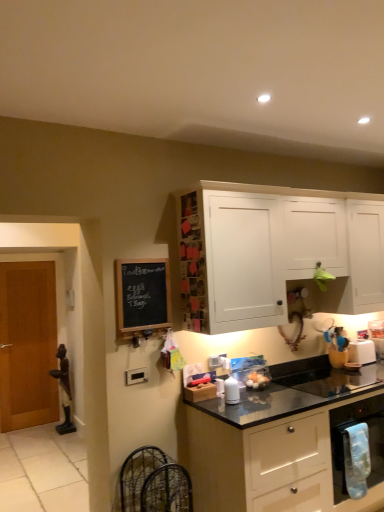
Question: Is white glossy salt shaker at center, which is the 2th appliance from right to left, facing towards white plastic toaster at right, which is the 2th appliance in front-to-back order?

Choices:
 (A) yes
 (B) no

Answer: (B)

Question: Is white glossy salt shaker at center, which is the 2th appliance from right to left, outside white plastic toaster at right, acting as the 1th appliance starting from the right?

Choices:
 (A) yes
 (B) no

Answer: (A)

Question: Can you confirm if white glossy salt shaker at center, which appears as the 1th appliance when viewed from the left, is smaller than white plastic toaster at right, which appears as the 2th appliance when viewed from the left?

Choices:
 (A) no
 (B) yes

Answer: (B)

Question: Is white glossy salt shaker at center, the 2th appliance in the back-to-front sequence, positioned behind white plastic toaster at right, acting as the 1th appliance starting from the right?

Choices:
 (A) no
 (B) yes

Answer: (A)

Question: Is white glossy salt shaker at center, the 2th appliance in the back-to-front sequence, at the right side of white plastic toaster at right, acting as the 1th appliance starting from the right?

Choices:
 (A) yes
 (B) no

Answer: (B)

Question: Considering the relative sizes of white glossy salt shaker at center, acting as the 1th appliance starting from the front, and white plastic toaster at right, acting as the 1th appliance starting from the right, in the image provided, is white glossy salt shaker at center, acting as the 1th appliance starting from the front, bigger than white plastic toaster at right, acting as the 1th appliance starting from the right,?

Choices:
 (A) yes
 (B) no

Answer: (B)

Question: From a real-world perspective, is black matte countertop at lower right, positioned as the 1th cabinetry in bottom-to-top order, on white glossy salt shaker at center, which appears as the 1th appliance when viewed from the left?

Choices:
 (A) no
 (B) yes

Answer: (A)

Question: Is black matte countertop at lower right, positioned as the 1th cabinetry in bottom-to-top order, to the right of white glossy salt shaker at center, the 2th appliance in the back-to-front sequence, from the viewer's perspective?

Choices:
 (A) no
 (B) yes

Answer: (B)

Question: Is the position of black matte countertop at lower right, positioned as the 1th cabinetry in bottom-to-top order, less distant than that of white glossy salt shaker at center, the 2th appliance in the back-to-front sequence?

Choices:
 (A) no
 (B) yes

Answer: (B)

Question: From a real-world perspective, does black matte countertop at lower right, positioned as the 1th cabinetry in bottom-to-top order, sit lower than white glossy salt shaker at center, which is the 2th appliance from right to left?

Choices:
 (A) yes
 (B) no

Answer: (A)

Question: Is black matte countertop at lower right, the 2th cabinetry positioned from the top, outside white glossy salt shaker at center, which is the 2th appliance from right to left?

Choices:
 (A) yes
 (B) no

Answer: (A)

Question: From the image's perspective, is black matte countertop at lower right, positioned as the 1th cabinetry in bottom-to-top order, on top of white glossy salt shaker at center, the 2th appliance in the back-to-front sequence?

Choices:
 (A) yes
 (B) no

Answer: (B)

Question: From the image's perspective, does black chalkboard at left appear lower than black granite sink at lower right?

Choices:
 (A) yes
 (B) no

Answer: (B)